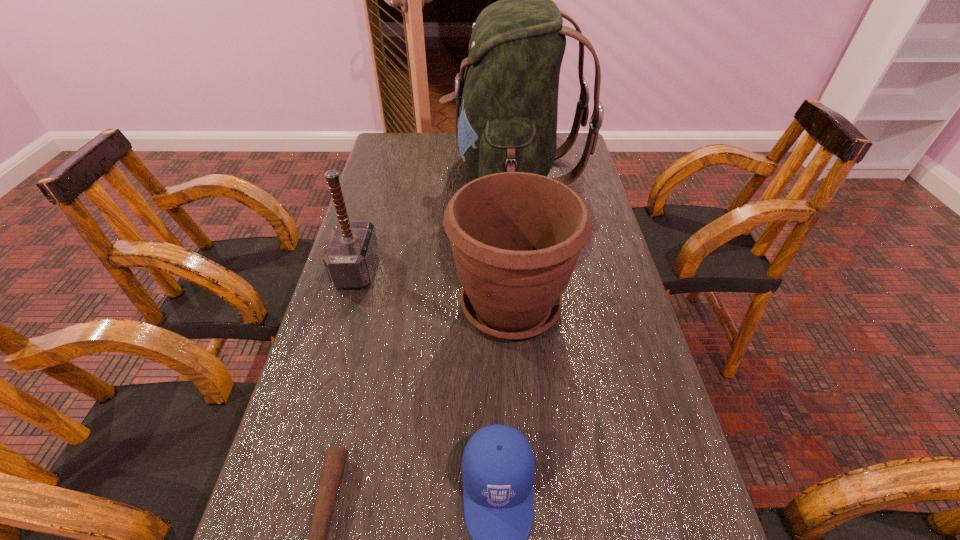
Image resolution: width=960 pixels, height=540 pixels. What are the coordinates of `backpack located at the right edge` in the screenshot? It's located at (508, 97).

Locate an element on the screen. The width and height of the screenshot is (960, 540). flowerpot present at the right edge is located at coordinates (516, 237).

The width and height of the screenshot is (960, 540). What are the coordinates of `object that is at the far right corner` in the screenshot? It's located at (508, 97).

Identify the location of vacant space at the left edge. The width and height of the screenshot is (960, 540). (389, 265).

This screenshot has height=540, width=960. In order to click on vacant space at the right edge in this screenshot , I will do `click(596, 240)`.

Where is `vacant region at the far left corner of the desktop`? vacant region at the far left corner of the desktop is located at coordinates (403, 159).

Identify the location of free space between the farther hammer and the flowerpot. (434, 287).

What are the coordinates of `vacant area that lies between the tallest object and the taller hammer` in the screenshot? It's located at (435, 221).

The height and width of the screenshot is (540, 960). I want to click on free space between the taller hammer and the flowerpot, so click(x=434, y=287).

The image size is (960, 540). Identify the location of object that is the second closest one to the farthest object. (350, 257).